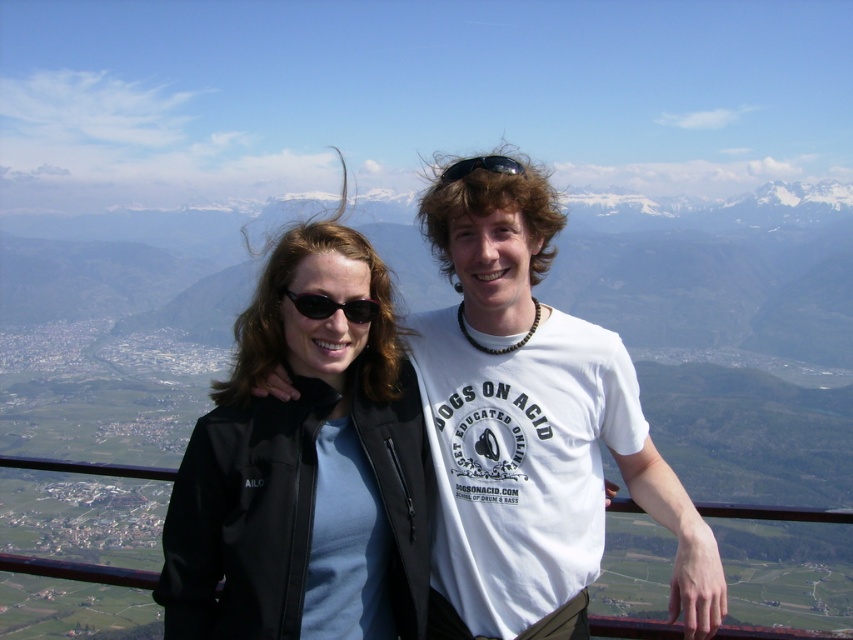
You are a photographer trying to capture the two jackets in the scene. Which jacket, the matte black jacket at center or the black matte jacket at center, is located to the right of the other?

A: The matte black jacket at center is positioned on the right side of black matte jacket at center.

You are a photographer trying to capture a clear shot of both the black matte jacket at center and the black plastic goggles at upper center in the image. Considering their sizes, which object should you focus on first to ensure it is in sharp focus?

The black matte jacket at center is much taller than the black plastic goggles at upper center, so you should focus on the black matte jacket at center first to ensure it is in sharp focus since it is larger and more prominent in the frame.

You are a photographer trying to frame a photo of the matte black jacket at center. What are the coordinates where you should focus your camera?

The coordinates where you should focus your camera are at point (532, 429).